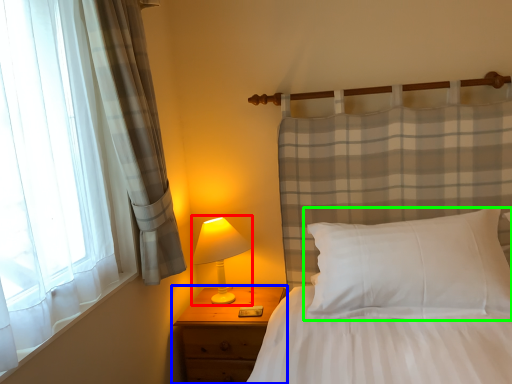
Question: Which object is the closest to the table lamp (highlighted by a red box)? Choose among these: nightstand (highlighted by a blue box) or pillow (highlighted by a green box).

Choices:
 (A) nightstand
 (B) pillow

Answer: (A)